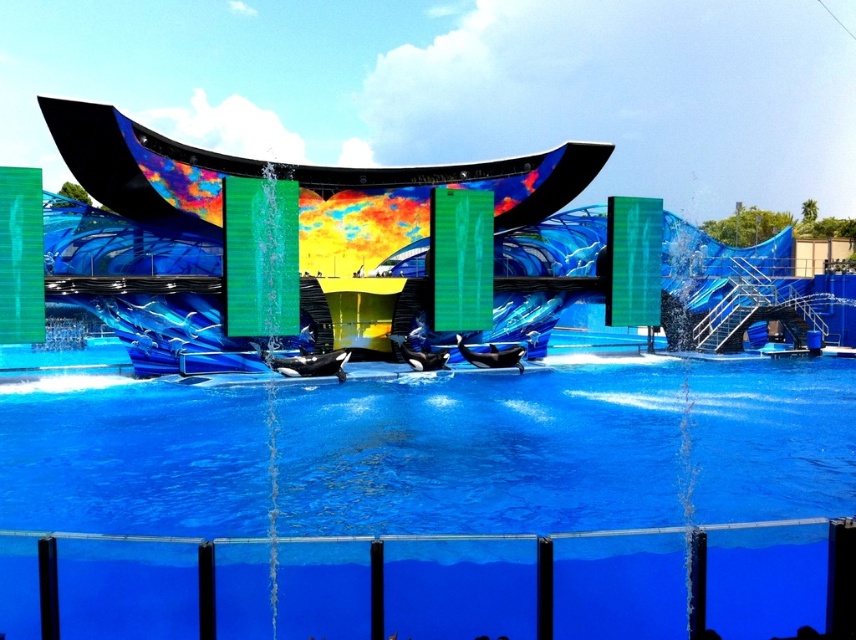
Who is more distant from viewer, (x=724, y=445) or (x=321, y=256)?

The point (x=321, y=256) is more distant.

Does point (409, 456) lie behind point (70, 204)?

No, (409, 456) is closer to viewer.

At what (x,y) coordinates should I click in order to perform the action: click on blue smooth water at center. Please return your answer as a coordinate pair (x, y). Looking at the image, I should click on click(569, 445).